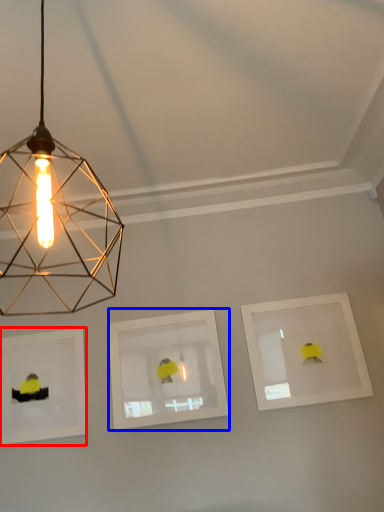
Question: Which object appears closest to the camera in this image, picture frame (highlighted by a red box) or picture frame (highlighted by a blue box)?

Choices:
 (A) picture frame
 (B) picture frame

Answer: (B)